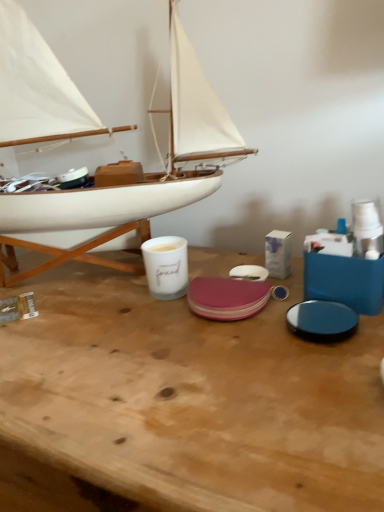
At what (x,y) coordinates should I click in order to perform the action: click on vacant position to the left of white ceramic mug at center. Please return your answer as a coordinate pair (x, y). The height and width of the screenshot is (512, 384). Looking at the image, I should click on (80, 298).